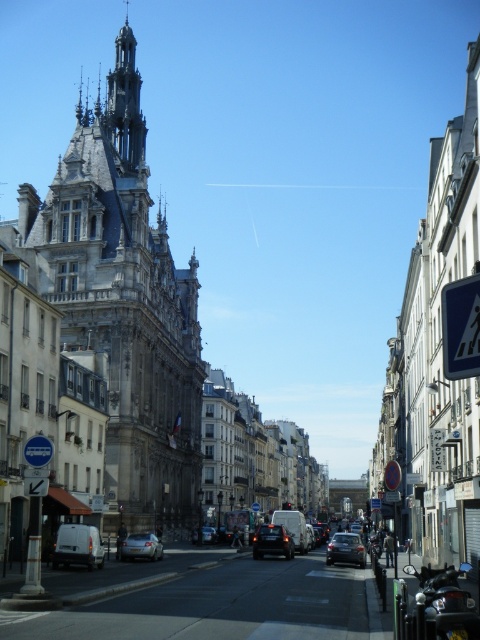
Question: Which object is closer to the camera taking this photo?

Choices:
 (A) shiny black sedan at center
 (B) shiny black car at center
 (C) silver metallic car at lower left
 (D) white matte van at lower left

Answer: (D)

Question: Which point is farther to the camera?

Choices:
 (A) white matte van at lower left
 (B) silver metallic car at lower left

Answer: (B)

Question: Does white matte van at lower left appear on the right side of silver metallic car at lower left?

Choices:
 (A) yes
 (B) no

Answer: (B)

Question: Is blue plastic arrow at lower left above shiny silver car at center?

Choices:
 (A) no
 (B) yes

Answer: (B)

Question: Which of the following is the farthest from the observer?

Choices:
 (A) stone gothic tower at upper left
 (B) black plastic pedestrian crossing sign at right

Answer: (A)

Question: Does white matte van at lower left have a lesser width compared to blue plastic arrow at lower left?

Choices:
 (A) yes
 (B) no

Answer: (B)